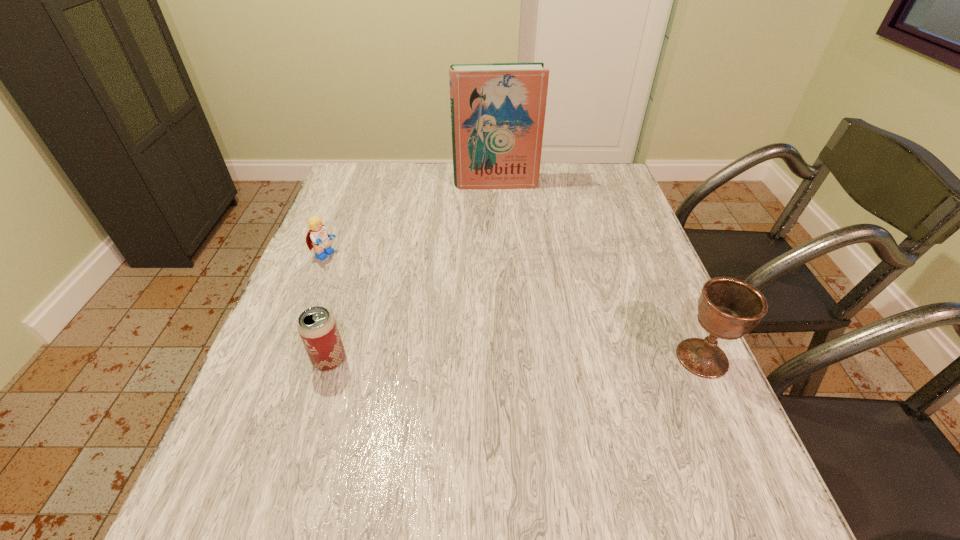
I want to click on the third object from right to left, so click(317, 327).

Find the location of a particular element. the rightmost object is located at coordinates (728, 308).

Locate an element on the screen. the third shortest object is located at coordinates (728, 308).

Where is `the second object from right to left`? This screenshot has width=960, height=540. the second object from right to left is located at coordinates (498, 110).

Find the location of a particular element. the tallest object is located at coordinates (498, 110).

Where is `the second farthest object`? The height and width of the screenshot is (540, 960). the second farthest object is located at coordinates (318, 238).

This screenshot has height=540, width=960. In order to click on Lego in this screenshot , I will do `click(318, 238)`.

This screenshot has height=540, width=960. Find the location of `vacant space located on the right of the third object from right to left`. vacant space located on the right of the third object from right to left is located at coordinates (375, 360).

I want to click on vacant area located on the back of the rightmost object, so click(650, 242).

Identify the location of vacant space located 0.310m on the cover of the third object from left to right. (506, 252).